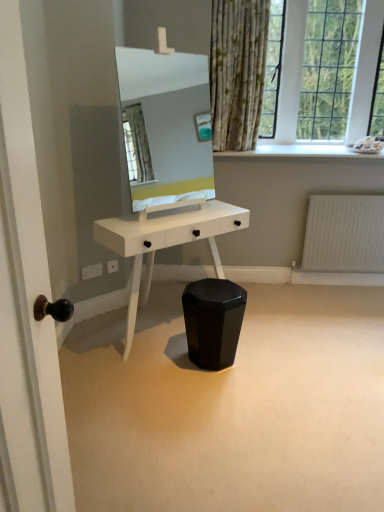
This screenshot has height=512, width=384. What are the coordinates of `blank area beneath clear glass window at upper right (from a real-world perspective)` in the screenshot? It's located at (316, 143).